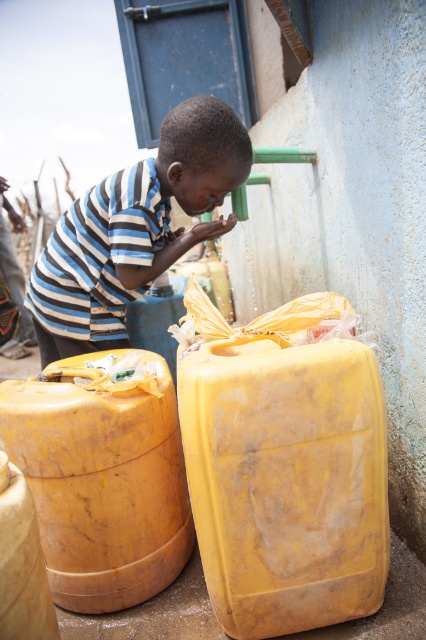
You are a parent standing next to the striped fabric boy at center and want to place a small toy on the ground between him and the matte yellow barrel at lower left. Can you fit the toy there without it being too close to either?

The matte yellow barrel at lower left is 18.09 inches away from the striped fabric boy at center. Since the distance is more than 12 inches, you can safely place the toy between them, ensuring it stays at least 6 inches away from each to avoid being too close.

What are the coordinates of the yellow matte barrel at right?

The yellow matte barrel at right is located at coordinates point (x=287, y=481).

You are standing at the point with coordinates point (239, 541) and want to walk towards the point with coordinates point (71, 596). Which direction should you face to walk directly towards it?

To walk directly towards point (71, 596) from point (239, 541), you should face southeast because point (239, 541) is in front of point (71, 596).